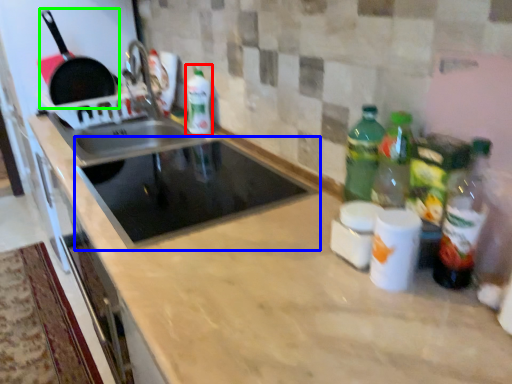
Question: Which object is the farthest from bottle (highlighted by a red box)? Choose among these: appliance (highlighted by a blue box) or frying pan (highlighted by a green box).

Choices:
 (A) appliance
 (B) frying pan

Answer: (B)